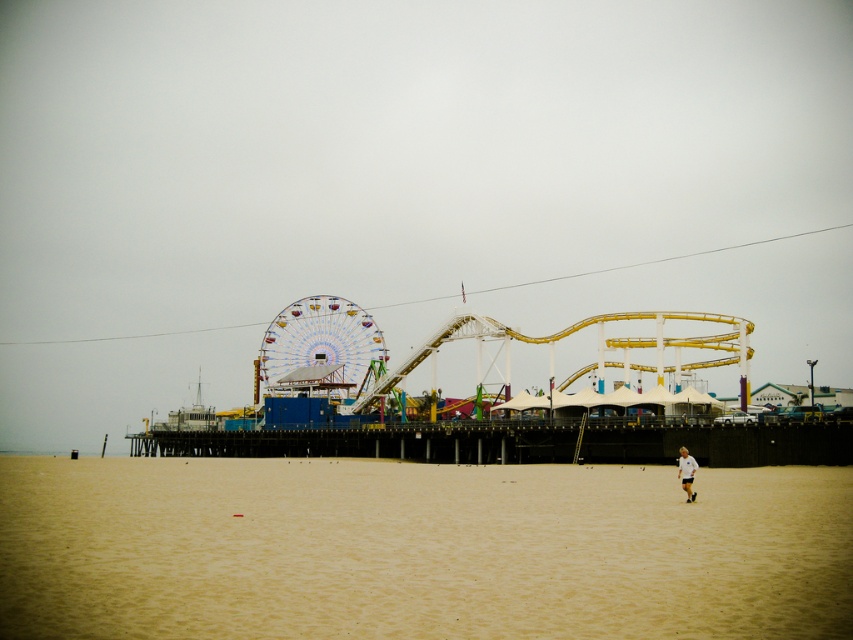
Question: Can you confirm if beige sand at lower center is positioned above white fabric person at lower right?

Choices:
 (A) no
 (B) yes

Answer: (A)

Question: Which of the following is the farthest from the observer?

Choices:
 (A) (682, 468)
 (B) (322, 324)

Answer: (B)

Question: Does wooden pier at center appear over white and blue striped ferris wheel at center?

Choices:
 (A) no
 (B) yes

Answer: (A)

Question: Which of these objects is positioned farthest from the beige sand at lower center?

Choices:
 (A) white fabric person at lower right
 (B) white and blue striped ferris wheel at center
 (C) wooden pier at center

Answer: (B)

Question: In this image, where is wooden pier at center located relative to white fabric person at lower right?

Choices:
 (A) below
 (B) above

Answer: (A)

Question: Among these points, which one is nearest to the camera?

Choices:
 (A) (683, 458)
 (B) (299, 344)

Answer: (A)